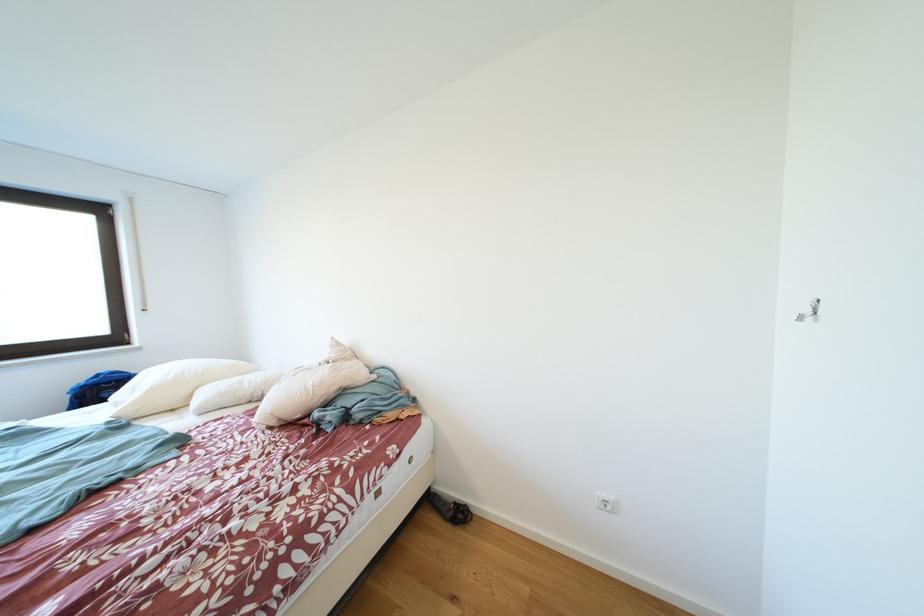
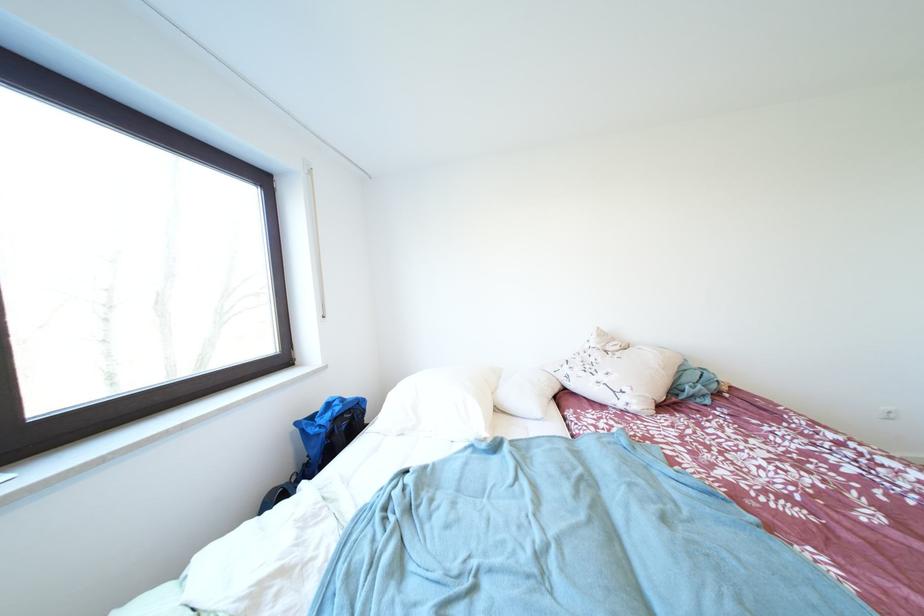
Question: In a continuous first-person perspective shot, in which direction is the camera moving?

Choices:
 (A) Left
 (B) Right
 (C) Forward
 (D) Backward

Answer: (A)